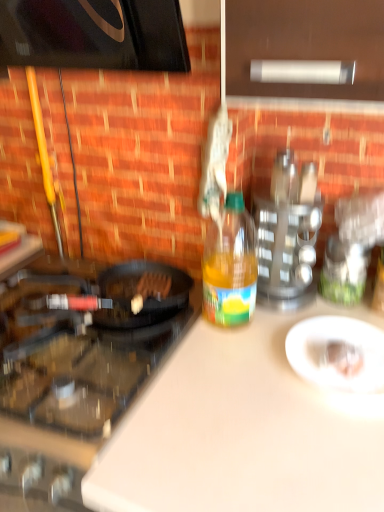
In order to click on space that is in front of white glossy plate at center in this screenshot , I will do `click(338, 425)`.